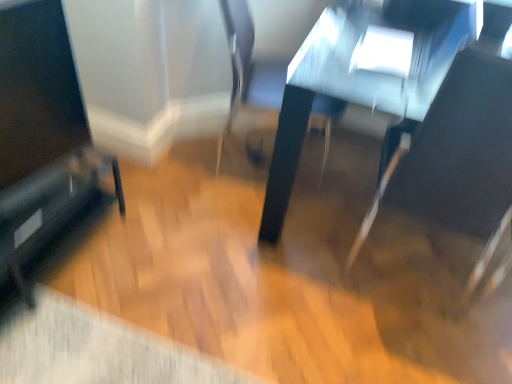
Question: Is black leather swivel chair at right, which is counted as the 1th swivel chair, starting from the right, to the left of shiny black table at center from the viewer's perspective?

Choices:
 (A) yes
 (B) no

Answer: (A)

Question: From a real-world perspective, is black leather swivel chair at right, arranged as the second swivel chair when viewed from the left, beneath shiny black table at center?

Choices:
 (A) no
 (B) yes

Answer: (A)

Question: Can you confirm if black leather swivel chair at right, arranged as the second swivel chair when viewed from the left, is wider than shiny black table at center?

Choices:
 (A) yes
 (B) no

Answer: (B)

Question: Considering the relative sizes of black leather swivel chair at right, which is counted as the 1th swivel chair, starting from the right, and shiny black table at center in the image provided, is black leather swivel chair at right, which is counted as the 1th swivel chair, starting from the right, thinner than shiny black table at center?

Choices:
 (A) yes
 (B) no

Answer: (A)

Question: Is black glossy speaker at lower left in front of or behind metallic silver swivel chair at center, which appears as the first swivel chair when viewed from the left, in the image?

Choices:
 (A) behind
 (B) front

Answer: (B)

Question: From a real-world perspective, is black glossy speaker at lower left physically located above or below metallic silver swivel chair at center, which appears as the first swivel chair when viewed from the left?

Choices:
 (A) below
 (B) above

Answer: (A)

Question: Is point (88, 170) closer or farther from the camera than point (241, 112)?

Choices:
 (A) closer
 (B) farther

Answer: (A)

Question: Based on their positions, is black glossy speaker at lower left located to the left or right of metallic silver swivel chair at center, which appears as the first swivel chair when viewed from the left?

Choices:
 (A) right
 (B) left

Answer: (B)

Question: Visually, is metallic silver swivel chair at center, which ranks as the second swivel chair in right-to-left order, positioned to the left or to the right of shiny black table at center?

Choices:
 (A) left
 (B) right

Answer: (A)

Question: Is metallic silver swivel chair at center, which appears as the first swivel chair when viewed from the left, in front of or behind shiny black table at center in the image?

Choices:
 (A) behind
 (B) front

Answer: (A)

Question: Is metallic silver swivel chair at center, which appears as the first swivel chair when viewed from the left, wider or thinner than shiny black table at center?

Choices:
 (A) wide
 (B) thin

Answer: (B)

Question: Based on their sizes in the image, would you say metallic silver swivel chair at center, which ranks as the second swivel chair in right-to-left order, is bigger or smaller than shiny black table at center?

Choices:
 (A) small
 (B) big

Answer: (A)

Question: From a real-world perspective, is black glossy screen at left above or below black glossy speaker at lower left?

Choices:
 (A) above
 (B) below

Answer: (A)

Question: Considering the relative positions of black glossy screen at left and black glossy speaker at lower left in the image provided, is black glossy screen at left to the left or to the right of black glossy speaker at lower left?

Choices:
 (A) right
 (B) left

Answer: (A)